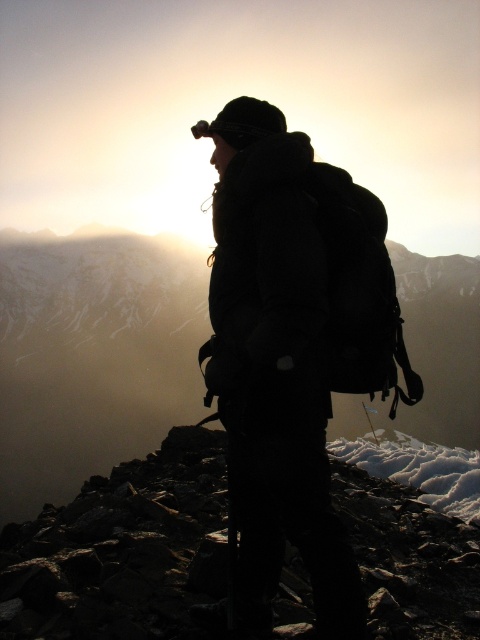
Question: Which object is farther from the camera taking this photo?

Choices:
 (A) smooth rock at center
 (B) rough stone at center

Answer: (A)

Question: Where is smooth rock at center located in relation to rough stone at center in the image?

Choices:
 (A) above
 (B) below

Answer: (A)

Question: Can you confirm if smooth rock at center is positioned below rough stone at center?

Choices:
 (A) no
 (B) yes

Answer: (A)

Question: Is smooth rock at center closer to camera compared to rough stone at center?

Choices:
 (A) yes
 (B) no

Answer: (B)